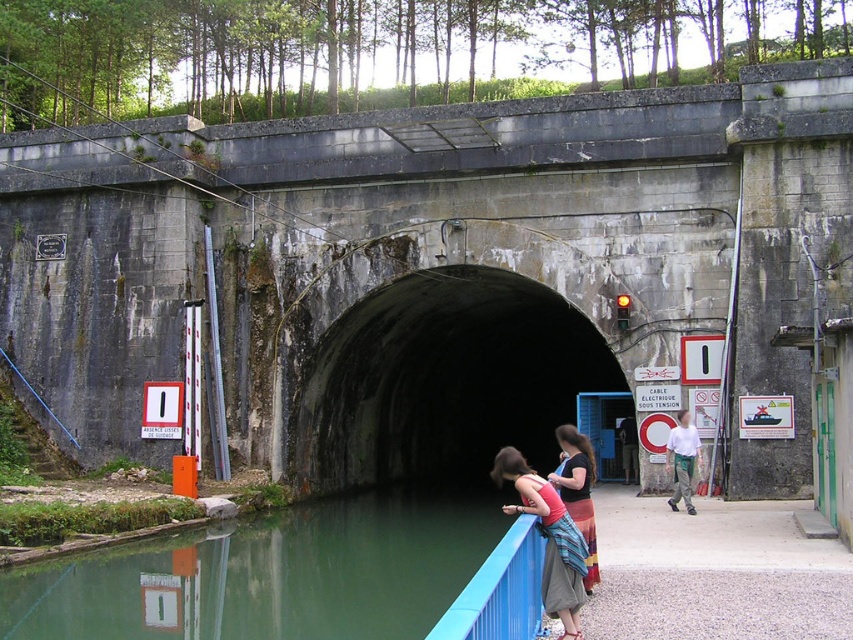
Question: Among these points, which one is farthest from the camera?

Choices:
 (A) (317, 509)
 (B) (466, 305)
 (C) (582, 520)

Answer: (B)

Question: Is concrete bridge at center wider than light beige pants at right?

Choices:
 (A) yes
 (B) no

Answer: (A)

Question: Can you confirm if matte pink tank top at center is positioned to the left of light beige pants at right?

Choices:
 (A) yes
 (B) no

Answer: (A)

Question: Which object is the closest to the dark concrete tunnel at center?

Choices:
 (A) matte pink tank top at center
 (B) light beige pants at right
 (C) matte black shirt at center

Answer: (A)

Question: Which point is farther to the camera?

Choices:
 (A) (444, 566)
 (B) (527, 532)
 (C) (157, 182)

Answer: (C)

Question: Where is blue painted metal rail at lower center located in relation to matte pink tank top at center in the image?

Choices:
 (A) above
 (B) below

Answer: (B)